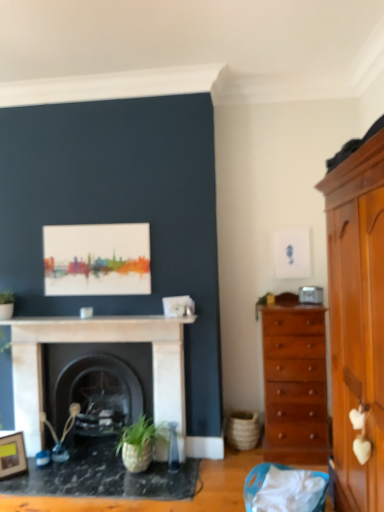
The height and width of the screenshot is (512, 384). Describe the element at coordinates (357, 318) in the screenshot. I see `light brown wooden cabinet at right` at that location.

In order to face wooden picture frame at lower left, should I rotate leftwards or rightwards?

A 22.827 degree turn to the left will do.

The image size is (384, 512). I want to click on wooden picture frame at lower left, so click(x=12, y=456).

I want to click on white marble fireplace at center, positioned as the first fireplace in front-to-back order, so click(x=98, y=342).

This screenshot has width=384, height=512. Find the location of `green matte plant at upper right`. green matte plant at upper right is located at coordinates (264, 302).

The height and width of the screenshot is (512, 384). What do you see at coordinates (264, 302) in the screenshot?
I see `green matte plant at upper right` at bounding box center [264, 302].

The width and height of the screenshot is (384, 512). What are the coordinates of `black marble table at lower left` in the screenshot? It's located at (104, 476).

Which object is more forward, black marble table at lower left or white marble fireplace at center, positioned as the first fireplace in front-to-back order?

black marble table at lower left is more forward.

The image size is (384, 512). What are the coordinates of `table that is in front of the white marble fireplace at center, which ranks as the second fireplace in back-to-front order` in the screenshot? It's located at (104, 476).

Who is smaller, black marble table at lower left or white marble fireplace at center, which ranks as the second fireplace in back-to-front order?

black marble table at lower left.

From a real-world perspective, which is physically above, black marble table at lower left or white marble fireplace at center, which ranks as the second fireplace in back-to-front order?

From a 3D spatial view, white marble fireplace at center, which ranks as the second fireplace in back-to-front order, is above.

Considering the positions of objects white marble fireplace at center and green matte plant at upper right in the image provided, who is more to the right, white marble fireplace at center or green matte plant at upper right?

From the viewer's perspective, green matte plant at upper right appears more on the right side.

Considering the positions of points (140, 322) and (270, 298), is point (140, 322) closer to camera compared to point (270, 298)?

Yes, it is.

Where is `counter top that appears below the green matte plant at upper right (from the image's perspective)`? counter top that appears below the green matte plant at upper right (from the image's perspective) is located at coordinates (98, 321).

Considering the sizes of objects shiny brown chest of drawers at right and white marble fireplace at center, positioned as the first fireplace in front-to-back order, in the image provided, who is wider, shiny brown chest of drawers at right or white marble fireplace at center, positioned as the first fireplace in front-to-back order,?

Wider between the two is shiny brown chest of drawers at right.

How much distance is there between shiny brown chest of drawers at right and white marble fireplace at center, positioned as the first fireplace in front-to-back order?

shiny brown chest of drawers at right is 1.02 meters away from white marble fireplace at center, positioned as the first fireplace in front-to-back order.

Between shiny brown chest of drawers at right and white marble fireplace at center, positioned as the first fireplace in front-to-back order, which one has less height?

With less height is white marble fireplace at center, positioned as the first fireplace in front-to-back order.

From a real-world perspective, which object stands above the other?

In real-world perspective, shiny brown chest of drawers at right is above.

How many degrees apart are the facing directions of shiny brown chest of drawers at right and black marble table at lower left?

The angle between the facing direction of shiny brown chest of drawers at right and the facing direction of black marble table at lower left is 3.48 degrees.

From a real-world perspective, is shiny brown chest of drawers at right beneath black marble table at lower left?

Incorrect, from a real-world perspective, shiny brown chest of drawers at right is higher than black marble table at lower left.

In terms of width, does shiny brown chest of drawers at right look wider or thinner when compared to black marble table at lower left?

Clearly, shiny brown chest of drawers at right has less width compared to black marble table at lower left.

Is shiny brown chest of drawers at right situated inside black marble table at lower left or outside?

shiny brown chest of drawers at right is outside black marble table at lower left.

Can you confirm if black marble fireplace at center, the first fireplace from the back, is wider than shiny brown chest of drawers at right?

No.

Is shiny brown chest of drawers at right completely or partially inside black marble fireplace at center, the first fireplace from the back?

No.

Is black marble fireplace at center, the first fireplace from the back, closer to camera compared to shiny brown chest of drawers at right?

No, black marble fireplace at center, the first fireplace from the back, is further to the viewer.

Does point (133, 369) come farther from viewer compared to point (292, 414)?

Yes.

From the image's perspective, would you say light brown wooden cabinet at right is shown under green matte plant at upper right?

Yes.

Considering the sizes of objects light brown wooden cabinet at right and green matte plant at upper right in the image provided, who is taller, light brown wooden cabinet at right or green matte plant at upper right?

With more height is light brown wooden cabinet at right.

Considering the sizes of objects light brown wooden cabinet at right and green matte plant at upper right in the image provided, who is smaller, light brown wooden cabinet at right or green matte plant at upper right?

Smaller between the two is green matte plant at upper right.

From the image's perspective, between white marble fireplace at center, which ranks as the second fireplace in back-to-front order, and shiny brown chest of drawers at right, which one is located above?

Result: From the image's view, shiny brown chest of drawers at right is above.

Is white marble fireplace at center, which ranks as the second fireplace in back-to-front order, in front of or behind shiny brown chest of drawers at right in the image?

white marble fireplace at center, which ranks as the second fireplace in back-to-front order, is positioned farther from the viewer than shiny brown chest of drawers at right.

Between white marble fireplace at center, which ranks as the second fireplace in back-to-front order, and shiny brown chest of drawers at right, which one has larger width?

shiny brown chest of drawers at right is wider.

Considering the positions of points (162, 413) and (263, 322), is point (162, 413) closer to camera compared to point (263, 322)?

No.

Where is `table directly beneath the white marble fireplace at center, which ranks as the second fireplace in back-to-front order (from a real-world perspective)`? The height and width of the screenshot is (512, 384). table directly beneath the white marble fireplace at center, which ranks as the second fireplace in back-to-front order (from a real-world perspective) is located at coordinates (104, 476).

I want to click on plant that appears above the white marble fireplace at center (from the image's perspective), so click(x=264, y=302).

Based on their spatial positions, is black marble table at lower left or green matte plant at upper right further from wooden picture frame at lower left?

green matte plant at upper right.

Which object lies nearer to the anchor point black marble table at lower left, green matte plant at upper right or shiny brown chest of drawers at right?

shiny brown chest of drawers at right is positioned closer to the anchor black marble table at lower left.

Which object lies further to the anchor point green matte plant at upper right, wooden picture frame at lower left or black marble fireplace at center, acting as the second fireplace starting from the front?

Based on the image, wooden picture frame at lower left appears to be further to green matte plant at upper right.

Considering their positions, is light brown wooden cabinet at right positioned closer to shiny brown chest of drawers at right than black marble table at lower left?

black marble table at lower left is closer to shiny brown chest of drawers at right.

When comparing their distances from white marble fireplace at center, does light brown wooden cabinet at right or shiny brown chest of drawers at right seem closer?

The object closer to white marble fireplace at center is shiny brown chest of drawers at right.

Looking at the image, which one is located further to green matte plant at upper right, black marble fireplace at center, the first fireplace from the back, or light brown wooden cabinet at right?

The object further to green matte plant at upper right is light brown wooden cabinet at right.

Considering their positions, is white marble fireplace at center, positioned as the first fireplace in front-to-back order, positioned further to white marble fireplace at center than shiny brown chest of drawers at right?

shiny brown chest of drawers at right lies further to white marble fireplace at center than the other object.

Looking at the image, which one is located further to light brown wooden cabinet at right, green matte plant at upper right or wooden picture frame at lower left?

wooden picture frame at lower left is positioned further to the anchor light brown wooden cabinet at right.

Locate an element on the screen. This screenshot has height=512, width=384. table situated between wooden picture frame at lower left and shiny brown chest of drawers at right from left to right is located at coordinates pos(104,476).

The width and height of the screenshot is (384, 512). What are the coordinates of `table positioned between light brown wooden cabinet at right and white marble fireplace at center from near to far` in the screenshot? It's located at (104, 476).

At what (x,y) coordinates should I click in order to perform the action: click on chest of drawers between wooden picture frame at lower left and light brown wooden cabinet at right in the horizontal direction. Please return your answer as a coordinate pair (x, y). Looking at the image, I should click on (295, 384).

The image size is (384, 512). Find the location of `plant situated between wooden picture frame at lower left and shiny brown chest of drawers at right from left to right`. plant situated between wooden picture frame at lower left and shiny brown chest of drawers at right from left to right is located at coordinates (264, 302).